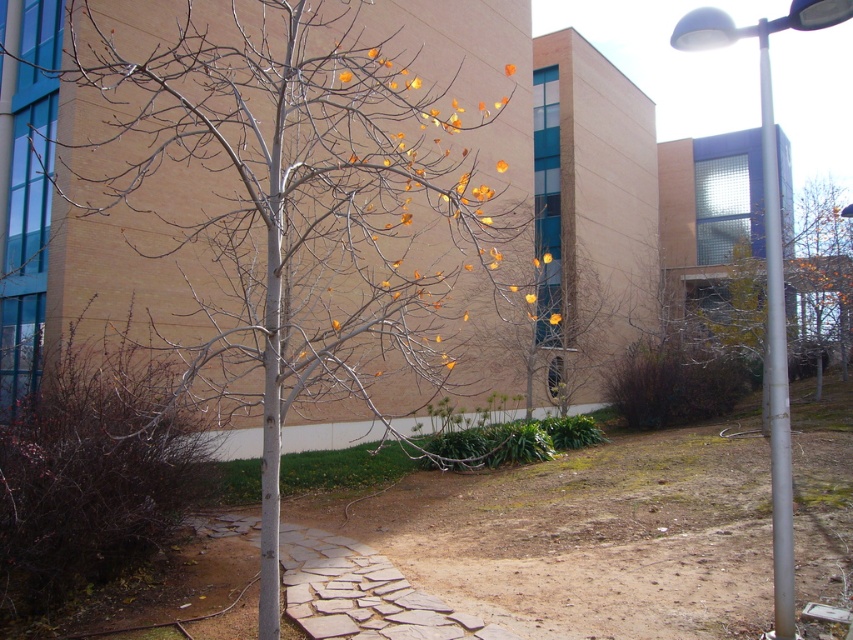
Question: Which point is closer to the camera?

Choices:
 (A) (770, 256)
 (B) (189, 188)

Answer: (A)

Question: Can you confirm if smooth gray tree at center is positioned above white metallic pole at right?

Choices:
 (A) no
 (B) yes

Answer: (A)

Question: Does smooth gray tree at center have a larger size compared to white metallic pole at right?

Choices:
 (A) no
 (B) yes

Answer: (A)

Question: Is smooth gray tree at center in front of white metallic pole at right?

Choices:
 (A) yes
 (B) no

Answer: (A)